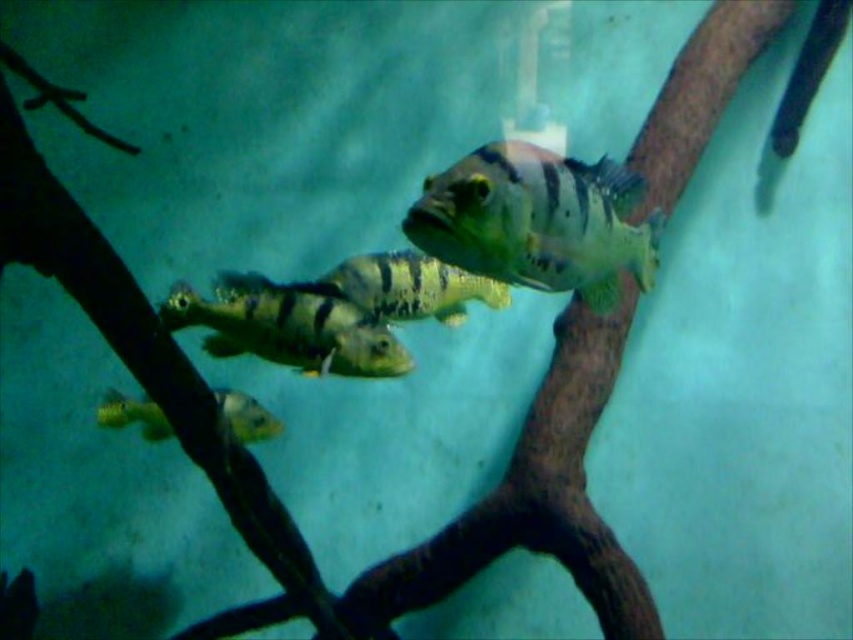
Question: Does shiny green fish at center have a larger size compared to greenish-yellow striped fish at center?

Choices:
 (A) yes
 (B) no

Answer: (A)

Question: Considering the real-world distances, which object is closest to the green striped fish at center?

Choices:
 (A) shiny green fish at center
 (B) greenish-yellow striped fish at center

Answer: (B)

Question: Which point is farther from the camera taking this photo?

Choices:
 (A) (352, 340)
 (B) (387, 266)
 (C) (250, 408)

Answer: (C)

Question: Which point appears closest to the camera in this image?

Choices:
 (A) (361, 260)
 (B) (560, 227)
 (C) (332, 362)

Answer: (B)

Question: Does greenish-yellow striped fish at center appear over shiny green fish at lower left?

Choices:
 (A) yes
 (B) no

Answer: (A)

Question: Does shiny green fish at center lie in front of shiny green fish at lower left?

Choices:
 (A) yes
 (B) no

Answer: (A)